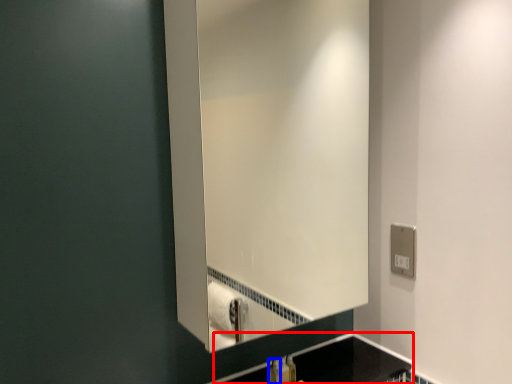
Question: Which object appears closest to the camera in this image, counter top (highlighted by a red box) or toiletry (highlighted by a blue box)?

Choices:
 (A) counter top
 (B) toiletry

Answer: (A)